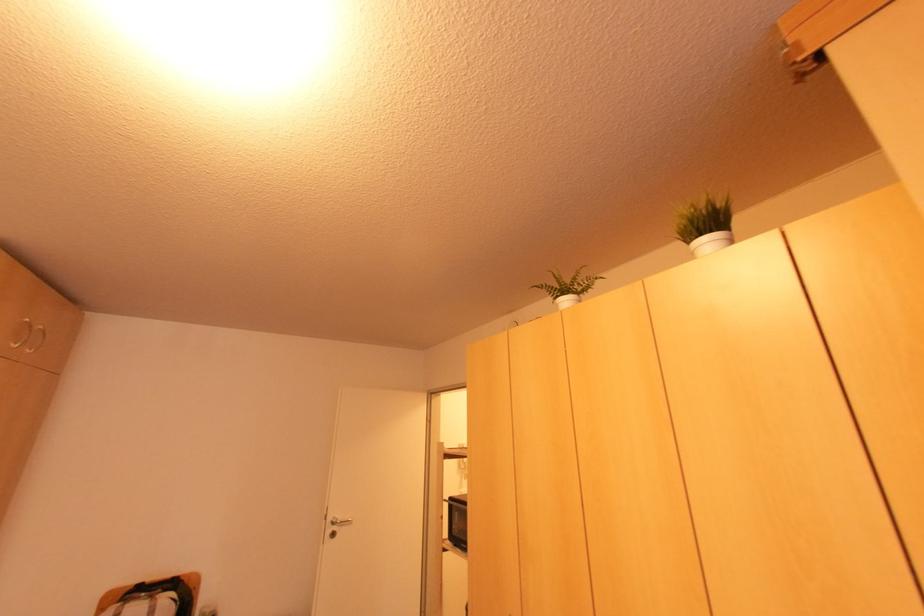
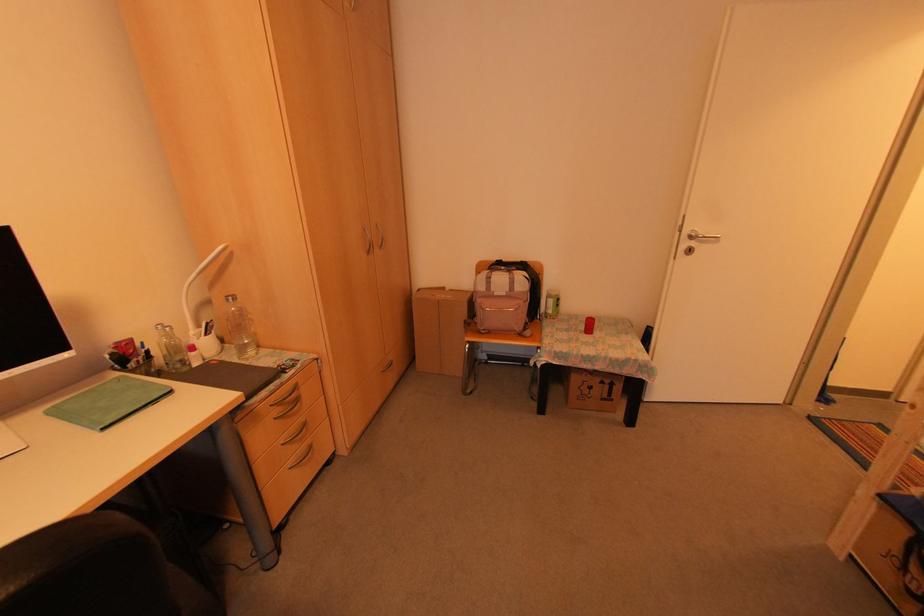
Find the pixel in the second image that matches (x=332, y=535) in the first image.

(687, 251)